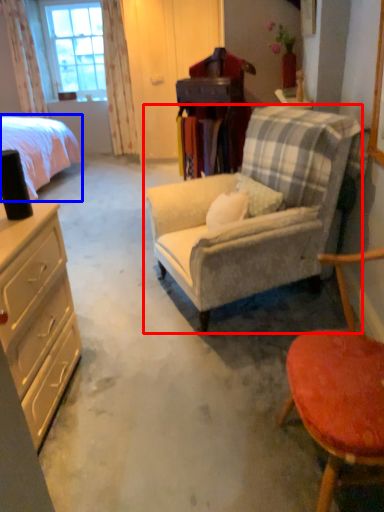
Question: Among these objects, which one is nearest to the camera, chair (highlighted by a red box) or bed (highlighted by a blue box)?

Choices:
 (A) chair
 (B) bed

Answer: (A)